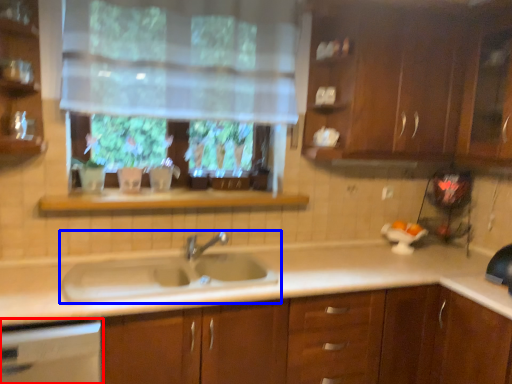
Question: Which point is further to the camera, dish washer (highlighted by a red box) or sink (highlighted by a blue box)?

Choices:
 (A) dish washer
 (B) sink

Answer: (B)